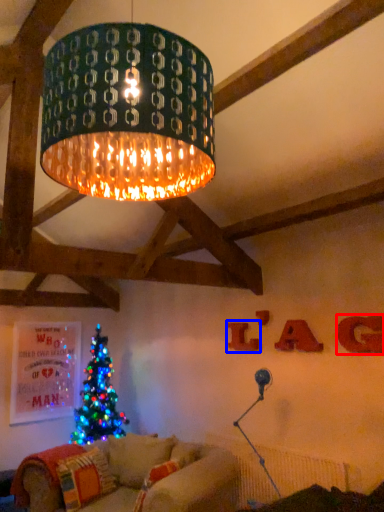
Question: Which object is closer to the camera taking this photo, letter (highlighted by a red box) or letter (highlighted by a blue box)?

Choices:
 (A) letter
 (B) letter

Answer: (A)